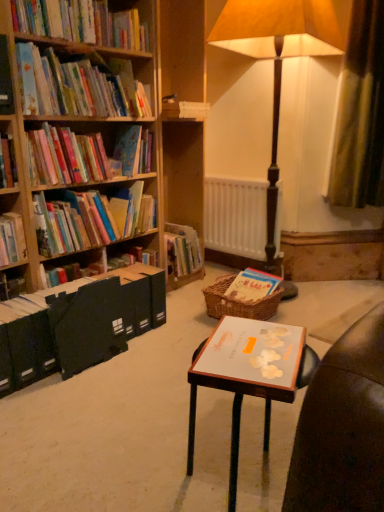
The width and height of the screenshot is (384, 512). I want to click on free point above white matte book at center, the 1th paperback book from the front (from a real-world perspective), so click(x=251, y=346).